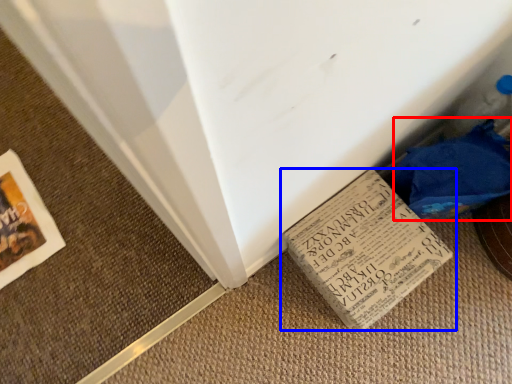
Question: Among these objects, which one is nearest to the camera, material (highlighted by a red box) or book (highlighted by a blue box)?

Choices:
 (A) material
 (B) book

Answer: (A)